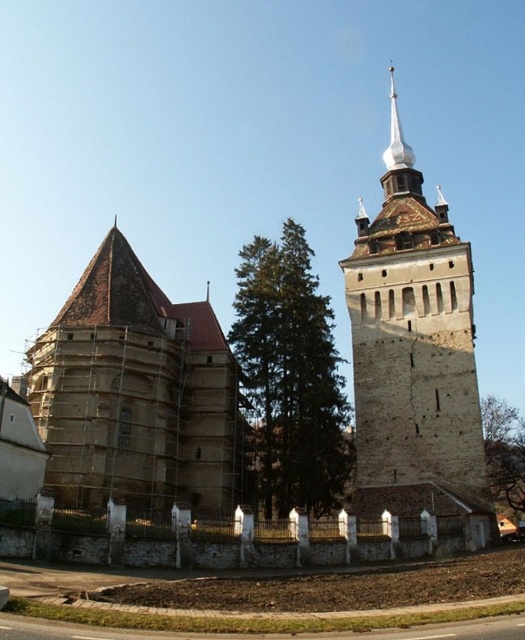
Question: Estimate the real-world distances between objects in this image. Which object is farther from the green textured tree at center?

Choices:
 (A) brown stone tower at center
 (B) brown wooden church at center

Answer: (A)

Question: Does brown wooden church at center have a lesser width compared to green textured tree at center?

Choices:
 (A) no
 (B) yes

Answer: (A)

Question: Can you confirm if brown stone tower at center is positioned below green leafy tree at lower right?

Choices:
 (A) yes
 (B) no

Answer: (B)

Question: Which point appears farthest from the camera in this image?

Choices:
 (A) (386, 230)
 (B) (334, 369)

Answer: (A)

Question: Does green textured tree at center appear on the left side of green leafy tree at lower right?

Choices:
 (A) yes
 (B) no

Answer: (A)

Question: Estimate the real-world distances between objects in this image. Which object is farther from the green textured tree at center?

Choices:
 (A) brown stone tower at center
 (B) brown wooden church at center

Answer: (A)